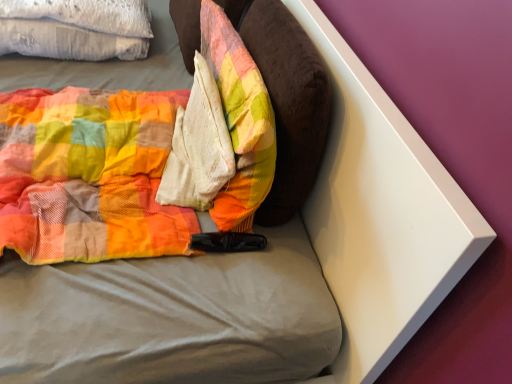
Question: Is white textured pillow at center a part of white textured pillow at upper left?

Choices:
 (A) yes
 (B) no

Answer: (B)

Question: Does white textured pillow at upper left have a larger size compared to white textured pillow at center?

Choices:
 (A) no
 (B) yes

Answer: (B)

Question: From a real-world perspective, is white textured pillow at upper left on white textured pillow at center?

Choices:
 (A) no
 (B) yes

Answer: (A)

Question: Considering the relative sizes of white textured pillow at upper left and white textured pillow at center in the image provided, is white textured pillow at upper left wider than white textured pillow at center?

Choices:
 (A) yes
 (B) no

Answer: (A)

Question: From the image's perspective, is white textured pillow at upper left beneath white textured pillow at center?

Choices:
 (A) yes
 (B) no

Answer: (B)

Question: Based on their positions, is white textured pillow at center located to the left or right of velvety brown pillow at center, marked as the 1th pillow in a right-to-left arrangement?

Choices:
 (A) left
 (B) right

Answer: (A)

Question: Is white textured pillow at center taller or shorter than velvety brown pillow at center, marked as the 1th pillow in a right-to-left arrangement?

Choices:
 (A) tall
 (B) short

Answer: (B)

Question: Is white textured pillow at center inside or outside of velvety brown pillow at center, marked as the 1th pillow in a right-to-left arrangement?

Choices:
 (A) inside
 (B) outside

Answer: (B)

Question: Is white textured pillow at center wider or thinner than velvety brown pillow at center, marked as the 1th pillow in a right-to-left arrangement?

Choices:
 (A) thin
 (B) wide

Answer: (B)

Question: From a real-world perspective, is plush fabric pillow at center, placed as the 2th pillow when sorted from right to left, physically located above or below velvety brown pillow at center, marked as the 1th pillow in a right-to-left arrangement?

Choices:
 (A) above
 (B) below

Answer: (B)

Question: Considering the positions of plush fabric pillow at center, placed as the 2th pillow when sorted from right to left, and velvety brown pillow at center, marked as the 1th pillow in a right-to-left arrangement, in the image, is plush fabric pillow at center, placed as the 2th pillow when sorted from right to left, taller or shorter than velvety brown pillow at center, marked as the 1th pillow in a right-to-left arrangement,?

Choices:
 (A) short
 (B) tall

Answer: (A)

Question: Is plush fabric pillow at center, which is counted as the first pillow, starting from the left, wider or thinner than velvety brown pillow at center, the 2th pillow in the left-to-right sequence?

Choices:
 (A) wide
 (B) thin

Answer: (A)

Question: Based on their sizes in the image, would you say plush fabric pillow at center, which is counted as the first pillow, starting from the left, is bigger or smaller than velvety brown pillow at center, marked as the 1th pillow in a right-to-left arrangement?

Choices:
 (A) small
 (B) big

Answer: (A)

Question: Considering the relative positions of velvety brown pillow at center, marked as the 1th pillow in a right-to-left arrangement, and white textured pillow at center in the image provided, is velvety brown pillow at center, marked as the 1th pillow in a right-to-left arrangement, to the left or to the right of white textured pillow at center?

Choices:
 (A) left
 (B) right

Answer: (B)

Question: From a real-world perspective, is velvety brown pillow at center, the 2th pillow in the left-to-right sequence, physically located above or below white textured pillow at center?

Choices:
 (A) above
 (B) below

Answer: (A)